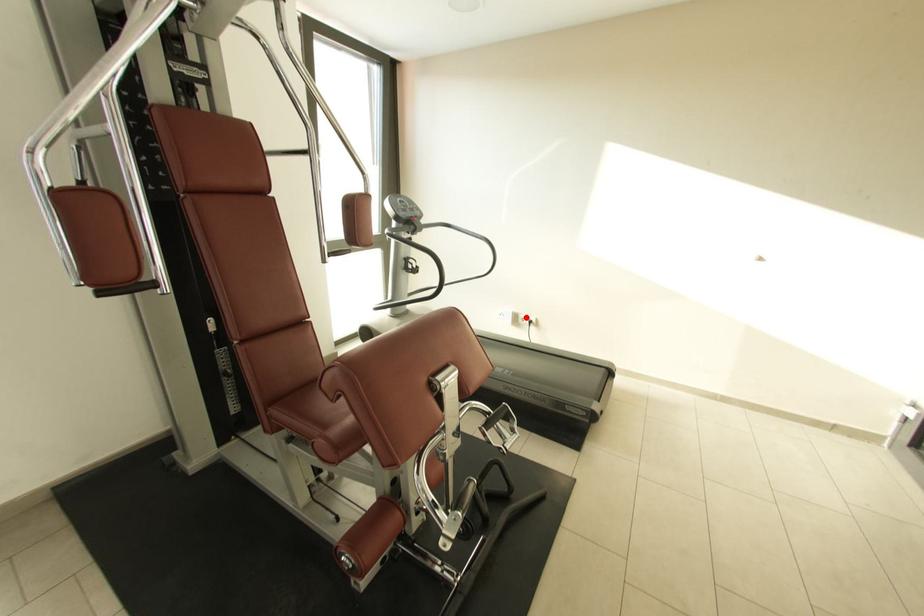
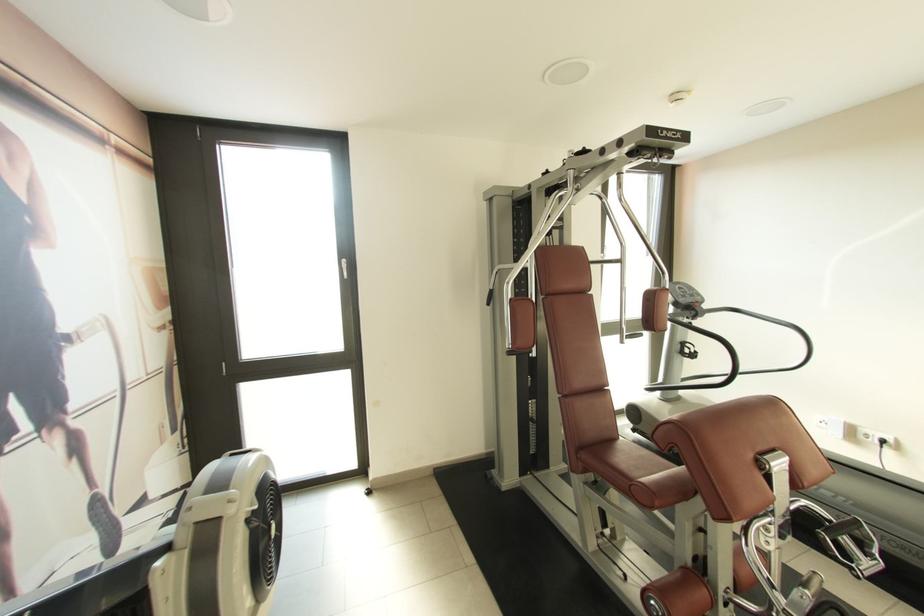
Find the pixel in the second image that matches the highlighted location in the first image.

(868, 432)